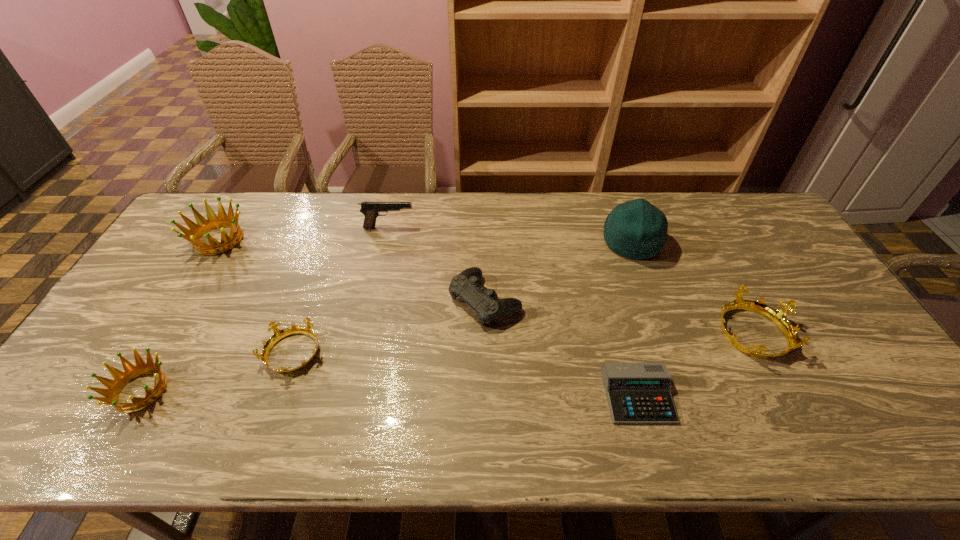
The height and width of the screenshot is (540, 960). Find the location of `the left gold crown`. the left gold crown is located at coordinates (278, 334).

Locate an element on the screen. Image resolution: width=960 pixels, height=540 pixels. calculator is located at coordinates point(638,393).

This screenshot has width=960, height=540. In order to click on gray calculator in this screenshot , I will do `click(638, 393)`.

Where is `free spot located 0.120m on the front of the beanie`? free spot located 0.120m on the front of the beanie is located at coordinates (650, 293).

Find the location of a particular element. free space located 0.310m at the muzzle of the fourth object from left to right is located at coordinates (506, 227).

The image size is (960, 540). Identify the location of blank area located 0.090m on the right of the farthest crown. (276, 240).

Find the location of a particular element. free space located 0.360m on the left of the bigger gold crown is located at coordinates (579, 332).

The width and height of the screenshot is (960, 540). Find the location of `free space located 0.090m on the right of the control`. free space located 0.090m on the right of the control is located at coordinates (552, 300).

Locate an element on the screen. vacant space located 0.130m on the back of the smaller golden crown is located at coordinates (181, 323).

Find the location of a particular element. Image resolution: width=960 pixels, height=540 pixels. vacant space located on the left of the shortest crown is located at coordinates (245, 354).